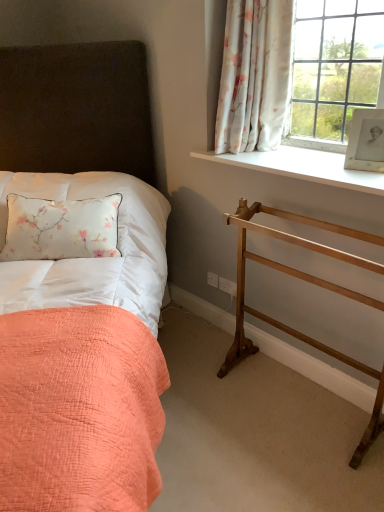
The image size is (384, 512). Identify the location of empty space that is ontop of white smooth window sill at upper right (from a real-world perspective). (296, 157).